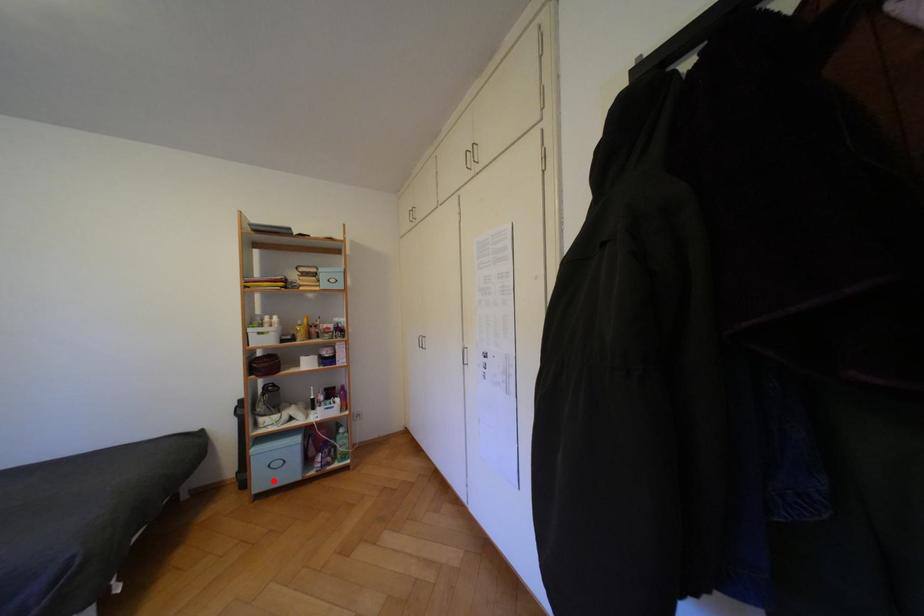
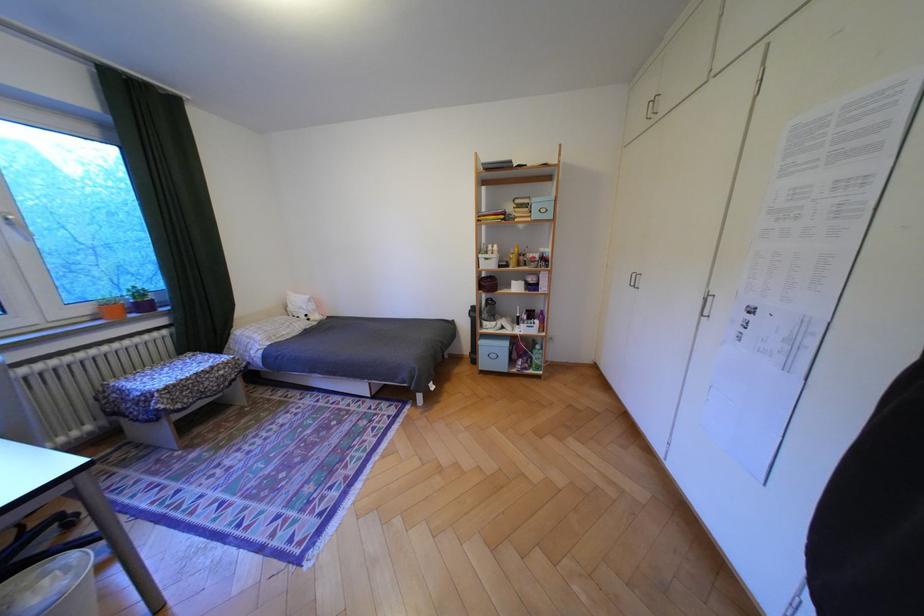
Question: I am providing you with two images of the same scene from different viewpoints. Given a red point in image1, look at the same physical point in image2. Is it:

Choices:
 (A) Closer to the viewpoint
 (B) Farther from the viewpoint

Answer: (B)